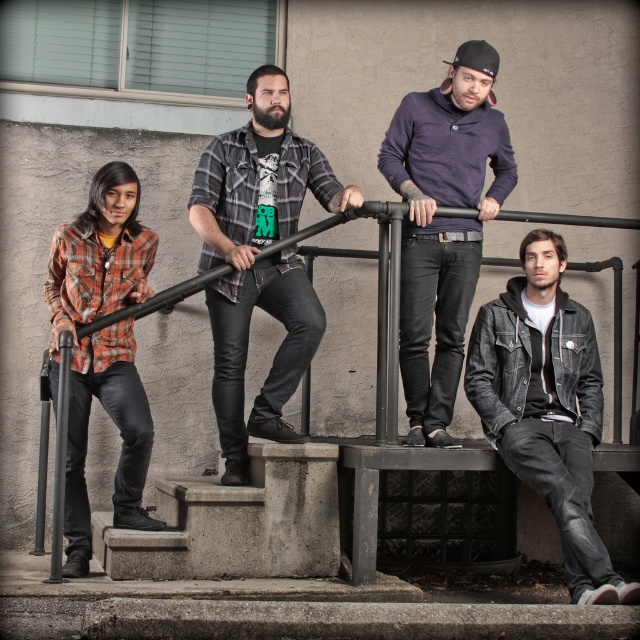
You are standing on the stairs and want to hand a note to the person wearing the purple sweater at center. Based on their position relative to the metal railing, can you estimate whether you should approach from the stair side or the wall side of the railing?

The purple sweater at center is located at point coordinates which place it closer to the wall side of the metal railing. Therefore, you should approach from the wall side to reach them effectively without obstruction.

You are trying to decide whether to place a large backpack on the concrete stairs at lower center or the denim jacket at lower right. Based on their sizes, which one can better accommodate the backpack?

The denim jacket at lower right is larger in size than the concrete stairs at lower center, so the backpack would fit better on the denim jacket at lower right.

You are standing on the concrete stairs at lower center and want to pick up the denim jacket at lower right. Can you reach it without moving from your current position?

The denim jacket at lower right is located above the concrete stairs at lower center, so you can reach it while standing on the concrete stairs at lower center without needing to move.